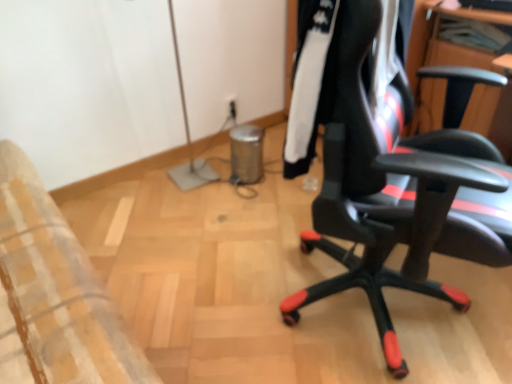
What are the coordinates of `black synthetic jacket at center right` in the screenshot? It's located at (313, 78).

What do you see at coordinates (313, 78) in the screenshot? The width and height of the screenshot is (512, 384). I see `black synthetic jacket at center right` at bounding box center [313, 78].

This screenshot has height=384, width=512. Describe the element at coordinates (396, 195) in the screenshot. I see `black leather office chair at right` at that location.

The image size is (512, 384). In order to click on black leather office chair at right in this screenshot , I will do `click(396, 195)`.

This screenshot has height=384, width=512. What are the coordinates of `black synthetic jacket at center right` in the screenshot? It's located at (313, 78).

Based on the photo, can you confirm if black leather office chair at right is positioned to the left of black synthetic jacket at center right?

No.

Between black leather office chair at right and black synthetic jacket at center right, which one is positioned in front?

black leather office chair at right.

Does point (483, 217) come farther from viewer compared to point (383, 117)?

No, (483, 217) is in front of (383, 117).

From the image's perspective, which one is positioned higher, black leather office chair at right or black synthetic jacket at center right?

black synthetic jacket at center right, from the image's perspective.

From a real-world perspective, is black leather office chair at right on top of black synthetic jacket at center right?

No.

Considering the sizes of objects black leather office chair at right and black synthetic jacket at center right in the image provided, who is wider, black leather office chair at right or black synthetic jacket at center right?

With larger width is black leather office chair at right.

Between black leather office chair at right and black synthetic jacket at center right, which one has more height?

black leather office chair at right.

Who is smaller, black leather office chair at right or black synthetic jacket at center right?

black synthetic jacket at center right is smaller.

Would you say black leather office chair at right is inside or outside black synthetic jacket at center right?

black leather office chair at right is spatially situated outside black synthetic jacket at center right.

Is black leather office chair at right not close to black synthetic jacket at center right?

No, black leather office chair at right is in close proximity to black synthetic jacket at center right.

Is black leather office chair at right oriented away from black synthetic jacket at center right?

Absolutely, black leather office chair at right is directed away from black synthetic jacket at center right.

Locate an element on the screen. The image size is (512, 384). clothing above the black leather office chair at right (from a real-world perspective) is located at coordinates (313, 78).

Considering the relative positions of black synthetic jacket at center right and black leather office chair at right in the image provided, is black synthetic jacket at center right to the left or to the right of black leather office chair at right?

black synthetic jacket at center right is positioned on black leather office chair at right's left side.

Which is in front, black synthetic jacket at center right or black leather office chair at right?

black leather office chair at right.

Does point (293, 177) come in front of point (451, 181)?

No, it is behind (451, 181).

From the image's perspective, is black synthetic jacket at center right above or below black leather office chair at right?

Based on their image positions, black synthetic jacket at center right is located above black leather office chair at right.

From a real-world perspective, is black synthetic jacket at center right positioned above or below black leather office chair at right?

Clearly, from a real-world perspective, black synthetic jacket at center right is above black leather office chair at right.

Between black synthetic jacket at center right and black leather office chair at right, which one has larger width?

With larger width is black leather office chair at right.

Is black synthetic jacket at center right shorter than black leather office chair at right?

Correct, black synthetic jacket at center right is not as tall as black leather office chair at right.

In the scene shown: Based on their sizes in the image, would you say black synthetic jacket at center right is bigger or smaller than black leather office chair at right?

In the image, black synthetic jacket at center right appears to be smaller than black leather office chair at right.

Is black synthetic jacket at center right inside the boundaries of black leather office chair at right, or outside?

black synthetic jacket at center right is inside black leather office chair at right.

Are black synthetic jacket at center right and black leather office chair at right beside each other?

No, black synthetic jacket at center right is not with black leather office chair at right.

Is black synthetic jacket at center right oriented away from black leather office chair at right?

Yes, black synthetic jacket at center right is facing away from black leather office chair at right.

How different are the orientations of black synthetic jacket at center right and black leather office chair at right in degrees?

The angular difference between black synthetic jacket at center right and black leather office chair at right is 0.00122 degrees.

Find the location of a particular element. chair that appears in front of the black synthetic jacket at center right is located at coordinates (396, 195).

Where is `clothing above the black leather office chair at right (from a real-world perspective)`? clothing above the black leather office chair at right (from a real-world perspective) is located at coordinates (313, 78).

Locate an element on the screen. The height and width of the screenshot is (384, 512). chair below the black synthetic jacket at center right (from the image's perspective) is located at coordinates (396, 195).